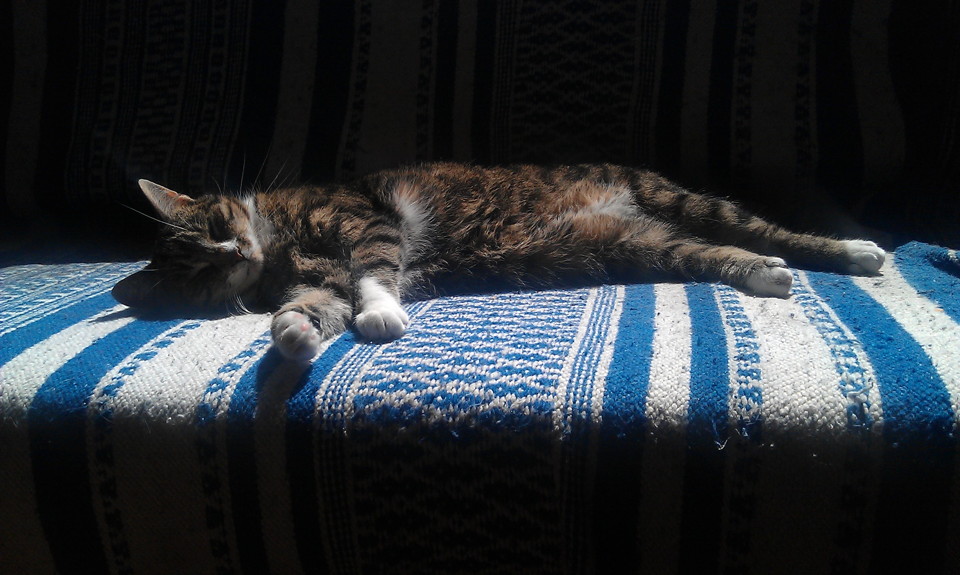
What are the coordinates of `blanket` in the screenshot? It's located at (539, 369).